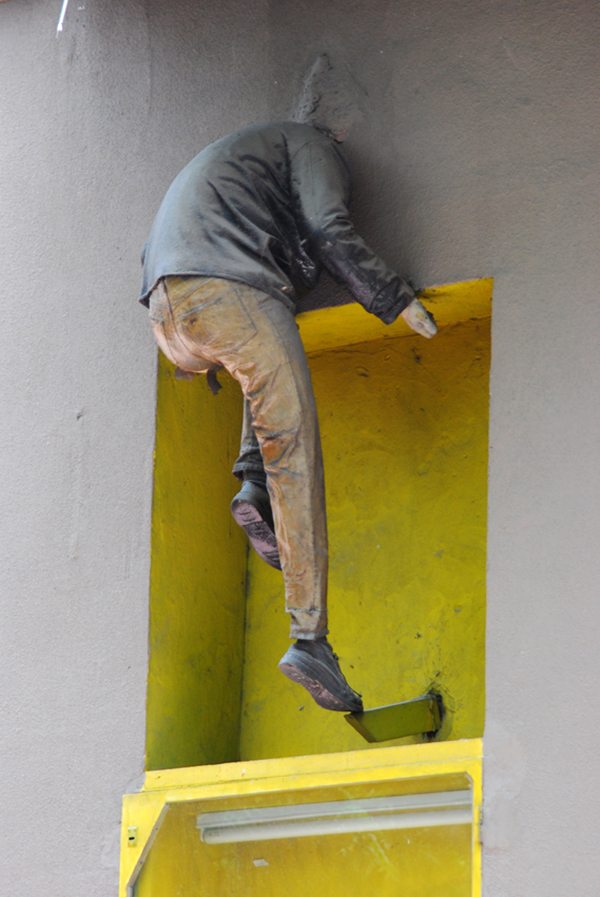
I want to click on yellow painted rectangular holes in wall, so click(x=201, y=484), click(x=351, y=331), click(x=380, y=484), click(x=348, y=869).